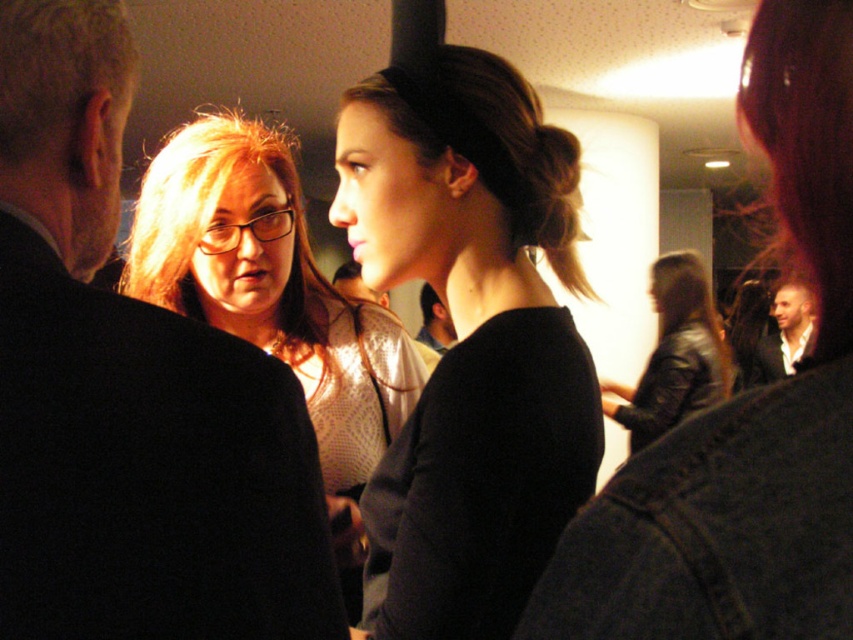
Is black suit at left further to the viewer compared to white shirt at right?

No.

Can you confirm if black suit at left is smaller than white shirt at right?

Yes, black suit at left is smaller than white shirt at right.

Is point (6, 589) closer to viewer compared to point (759, 368)?

Yes.

Where is `black suit at left`? The height and width of the screenshot is (640, 853). black suit at left is located at coordinates (131, 394).

Consider the image. Who is positioned more to the right, black matte shirt at center or matte black sweater at center?

From the viewer's perspective, black matte shirt at center appears more on the right side.

Does black matte shirt at center appear under matte black sweater at center?

Yes.

Describe the element at coordinates (469, 340) in the screenshot. I see `black matte shirt at center` at that location.

Identify the location of black matte shirt at center. (469, 340).

Does black matte shirt at center have a lesser height compared to black leather jacket at lower right?

Yes, black matte shirt at center is shorter than black leather jacket at lower right.

Is black matte shirt at center to the right of black leather jacket at lower right from the viewer's perspective?

In fact, black matte shirt at center is to the left of black leather jacket at lower right.

Does point (432, 513) lie behind point (756, 332)?

No.

What are the coordinates of `black matte shirt at center` in the screenshot? It's located at (469, 340).